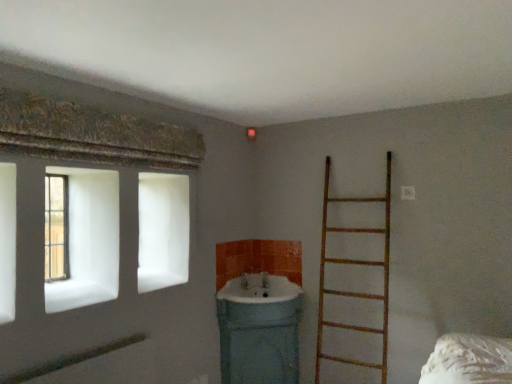
Question: Would you say wooden ladder at right contains matte white sink at center, arranged as the first sink when ordered from the bottom?

Choices:
 (A) yes
 (B) no

Answer: (B)

Question: Is wooden ladder at right touching matte white sink at center, arranged as the first sink when ordered from the bottom?

Choices:
 (A) no
 (B) yes

Answer: (A)

Question: Can you confirm if wooden ladder at right is thinner than matte white sink at center, arranged as the first sink when ordered from the bottom?

Choices:
 (A) yes
 (B) no

Answer: (A)

Question: Is wooden ladder at right in front of matte white sink at center, arranged as the first sink when ordered from the bottom?

Choices:
 (A) yes
 (B) no

Answer: (A)

Question: Considering the relative sizes of wooden ladder at right and matte white sink at center, arranged as the first sink when ordered from the bottom, in the image provided, is wooden ladder at right shorter than matte white sink at center, arranged as the first sink when ordered from the bottom,?

Choices:
 (A) yes
 (B) no

Answer: (B)

Question: Is wooden ladder at right further to camera compared to matte white sink at center, the 2th sink from the top?

Choices:
 (A) no
 (B) yes

Answer: (A)

Question: Is matte white sink at center, the 2th sink from the top, facing away from wooden ladder at right?

Choices:
 (A) yes
 (B) no

Answer: (B)

Question: Considering the relative positions of matte white sink at center, the 2th sink from the top, and wooden ladder at right in the image provided, is matte white sink at center, the 2th sink from the top, behind wooden ladder at right?

Choices:
 (A) yes
 (B) no

Answer: (A)

Question: Considering the relative sizes of matte white sink at center, arranged as the first sink when ordered from the bottom, and wooden ladder at right in the image provided, is matte white sink at center, arranged as the first sink when ordered from the bottom, shorter than wooden ladder at right?

Choices:
 (A) no
 (B) yes

Answer: (B)

Question: Does matte white sink at center, arranged as the first sink when ordered from the bottom, have a larger size compared to wooden ladder at right?

Choices:
 (A) no
 (B) yes

Answer: (A)

Question: From the image's perspective, is matte white sink at center, arranged as the first sink when ordered from the bottom, below wooden ladder at right?

Choices:
 (A) yes
 (B) no

Answer: (A)

Question: Is matte white sink at center, arranged as the first sink when ordered from the bottom, closer to the viewer compared to wooden ladder at right?

Choices:
 (A) no
 (B) yes

Answer: (A)

Question: Is wooden frame window at left positioned before matte white sink at center, arranged as the first sink when ordered from the bottom?

Choices:
 (A) no
 (B) yes

Answer: (B)